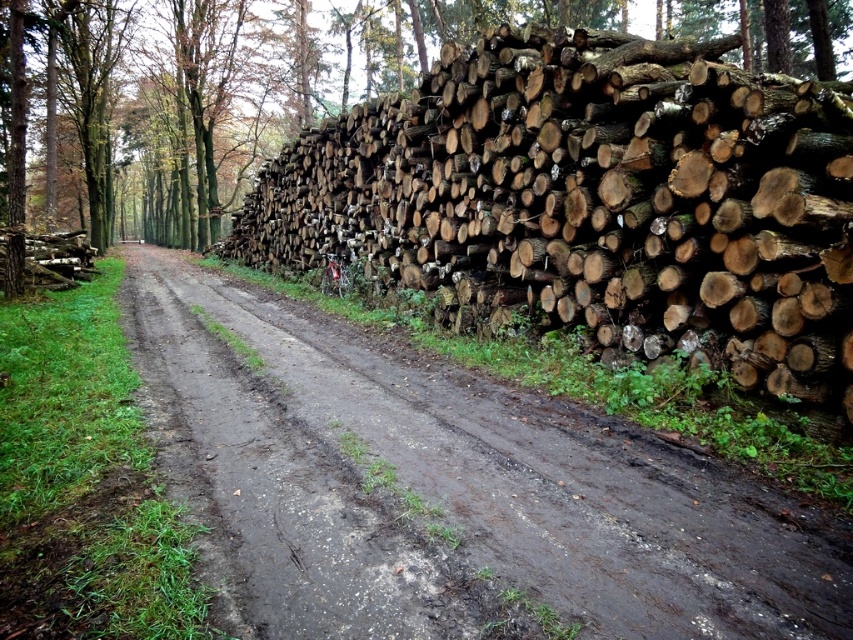
Question: Which of the following is the closest to the observer?

Choices:
 (A) (496, 506)
 (B) (828, 202)

Answer: (A)

Question: Which object is farther from the camera taking this photo?

Choices:
 (A) natural wood logs at right
 (B) dull brown dirt track at center

Answer: (A)

Question: Observing the image, what is the correct spatial positioning of natural wood logs at right in reference to dull brown dirt track at center?

Choices:
 (A) above
 (B) below

Answer: (A)

Question: Does natural wood logs at right have a lesser width compared to dull brown dirt track at center?

Choices:
 (A) yes
 (B) no

Answer: (A)

Question: Considering the relative positions of natural wood logs at right and dull brown dirt track at center in the image provided, where is natural wood logs at right located with respect to dull brown dirt track at center?

Choices:
 (A) right
 (B) left

Answer: (A)

Question: Which of the following is the farthest from the observer?

Choices:
 (A) (543, 99)
 (B) (426, 448)

Answer: (A)